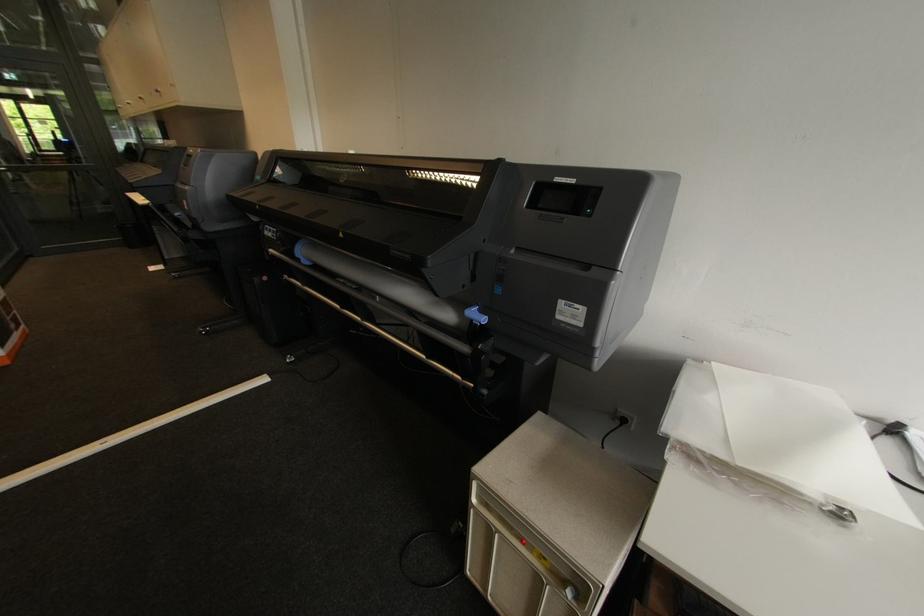
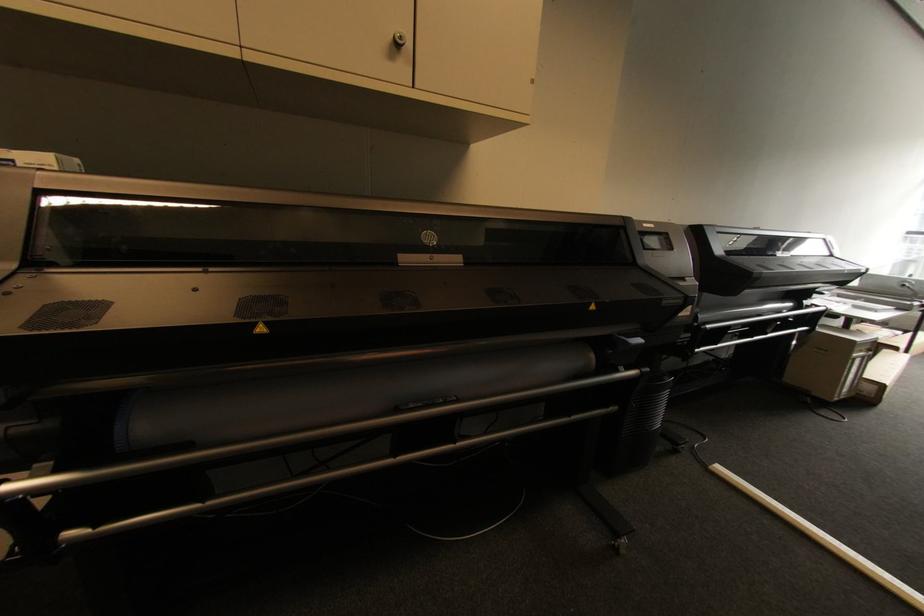
Locate, in the second image, the point that corresponds to point 526,541 in the first image.

(867, 352)